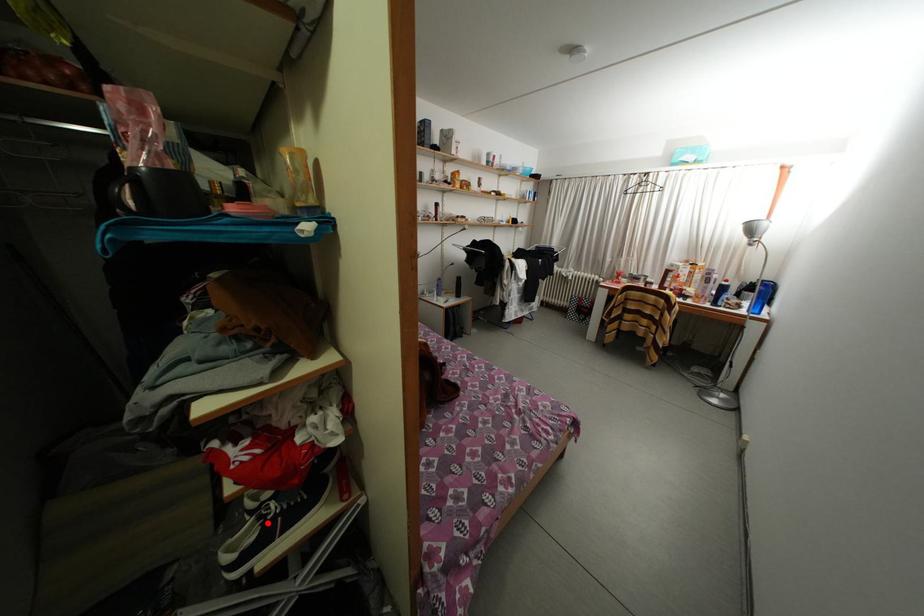
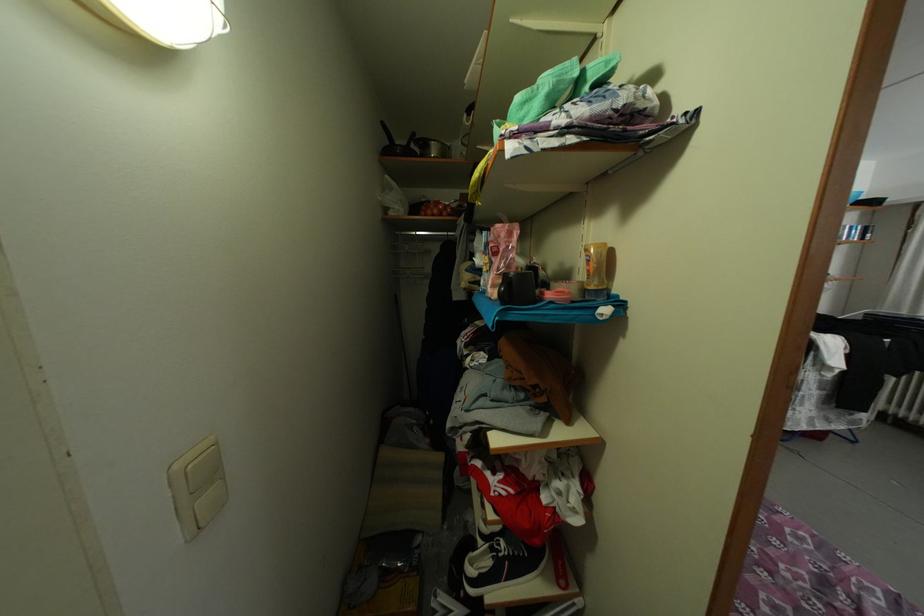
Where in the second image is the point corresponding to the highlighted location from the first image?

(500, 554)